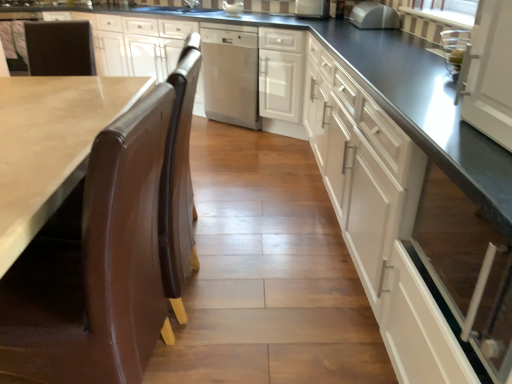
Question: Does white striped fabric at upper right have a greater height compared to white glossy cabinet at right, which appears as the first cabinetry when viewed from the front?

Choices:
 (A) no
 (B) yes

Answer: (A)

Question: From the image's perspective, is white striped fabric at upper right above white glossy cabinet at right, which appears as the first cabinetry when viewed from the front?

Choices:
 (A) yes
 (B) no

Answer: (A)

Question: From the image's perspective, does white striped fabric at upper right appear lower than white glossy cabinet at right, which appears as the first cabinetry when viewed from the front?

Choices:
 (A) no
 (B) yes

Answer: (A)

Question: Does white striped fabric at upper right have a lesser width compared to white glossy cabinet at right, the 2th cabinetry in the back-to-front sequence?

Choices:
 (A) no
 (B) yes

Answer: (B)

Question: Considering the relative sizes of white striped fabric at upper right and white glossy cabinet at right, the 2th cabinetry in the back-to-front sequence, in the image provided, is white striped fabric at upper right bigger than white glossy cabinet at right, the 2th cabinetry in the back-to-front sequence,?

Choices:
 (A) no
 (B) yes

Answer: (A)

Question: Is white glossy cabinet at right, the 2th cabinetry in the back-to-front sequence, inside or outside of brown leather chair at left?

Choices:
 (A) inside
 (B) outside

Answer: (B)

Question: Considering their positions, is white glossy cabinet at right, which appears as the first cabinetry when viewed from the front, located in front of or behind brown leather chair at left?

Choices:
 (A) behind
 (B) front

Answer: (B)

Question: Would you say white glossy cabinet at right, which appears as the first cabinetry when viewed from the front, is to the left or to the right of brown leather chair at left in the picture?

Choices:
 (A) left
 (B) right

Answer: (B)

Question: Is white glossy cabinet at right, the 2th cabinetry in the back-to-front sequence, bigger or smaller than brown leather chair at left?

Choices:
 (A) small
 (B) big

Answer: (B)

Question: In the image, is satin silver microwave at upper center, the 1th appliance from the front, positioned in front of or behind white striped fabric at upper right?

Choices:
 (A) behind
 (B) front

Answer: (A)

Question: In terms of height, does satin silver microwave at upper center, the third appliance when ordered from left to right, look taller or shorter compared to white striped fabric at upper right?

Choices:
 (A) tall
 (B) short

Answer: (A)

Question: Is point (359, 6) closer or farther from the camera than point (470, 13)?

Choices:
 (A) farther
 (B) closer

Answer: (A)

Question: Is satin silver microwave at upper center, the third appliance when ordered from left to right, situated inside white striped fabric at upper right or outside?

Choices:
 (A) inside
 (B) outside

Answer: (B)

Question: Looking at their shapes, would you say brown polished wood countertop at lower left is wider or thinner than white glossy gravy boat at center, positioned as the first appliance in left-to-right order?

Choices:
 (A) thin
 (B) wide

Answer: (B)

Question: Considering the positions of brown polished wood countertop at lower left and white glossy gravy boat at center, which appears as the first appliance when viewed from the back, in the image, is brown polished wood countertop at lower left bigger or smaller than white glossy gravy boat at center, which appears as the first appliance when viewed from the back,?

Choices:
 (A) small
 (B) big

Answer: (B)